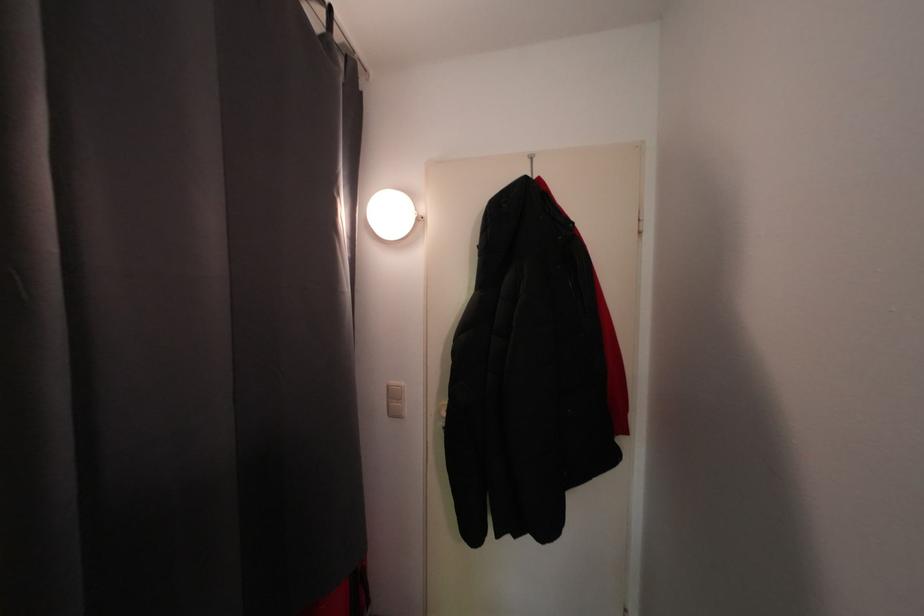
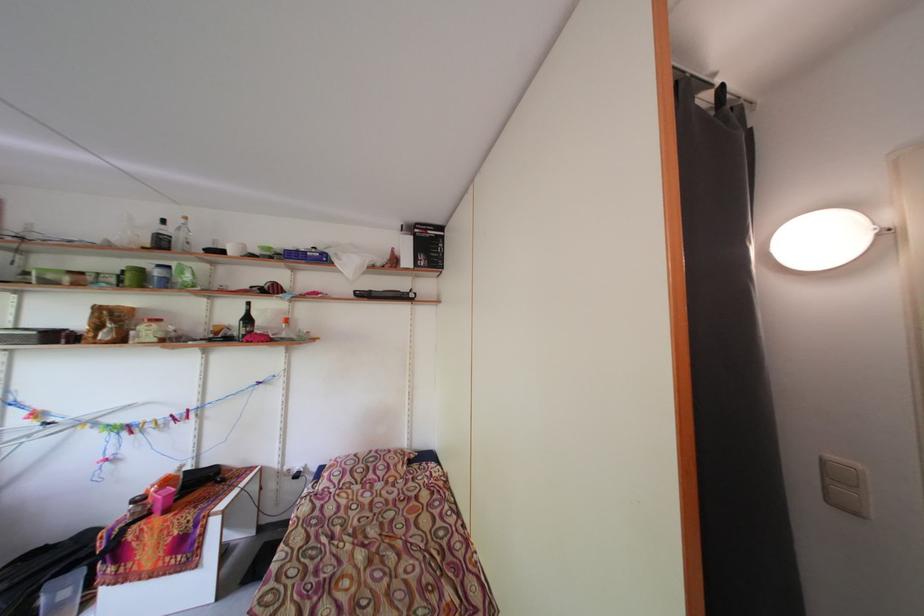
In the second image, find the point that corresponds to [403,400] in the first image.

(844, 480)